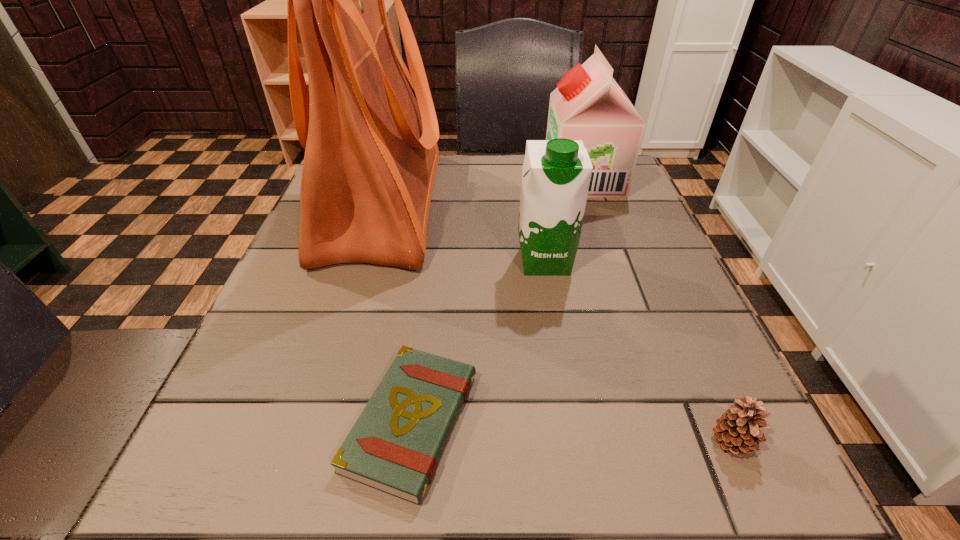
I want to click on vacant space in between the book and the nearer soya milk, so click(x=478, y=341).

Locate an element on the screen. unoccupied position between the tallest object and the second shortest object is located at coordinates (558, 324).

Identify the location of vacant area that lies between the shortest object and the nearer soya milk. (478, 341).

Image resolution: width=960 pixels, height=540 pixels. What are the coordinates of `vacant space in between the shortest object and the fourth tallest object` in the screenshot? It's located at (572, 433).

Image resolution: width=960 pixels, height=540 pixels. I want to click on free space between the book and the farther soya milk, so click(497, 300).

Image resolution: width=960 pixels, height=540 pixels. In order to click on object that is the closest one to the farther soya milk in this screenshot , I will do `click(556, 173)`.

Select which object is the second closest to the shortest object. Please provide its 2D coordinates. Your answer should be formatted as a tuple, i.e. [(x, y)], where the tuple contains the x and y coordinates of a point satisfying the conditions above.

[(556, 173)]

The image size is (960, 540). I want to click on free space that satisfies the following two spatial constraints: 1. on the back side of the shortest object; 2. on the front pocket of the shopping bag, so click(x=439, y=205).

You are a GUI agent. You are given a task and a screenshot of the screen. Output one action in this format:
    pyautogui.click(x=<x>, y=<y>)
    Task: Click on the free spot that satisfies the following two spatial constraints: 1. on the front pocket of the shortest object; 2. on the right side of the tallest object
    The width and height of the screenshot is (960, 540).
    Given the screenshot: What is the action you would take?
    pyautogui.click(x=318, y=422)

In order to click on free location that satisfies the following two spatial constraints: 1. on the back side of the pinecone; 2. on the front pocket of the tallest object in this screenshot , I will do `click(626, 205)`.